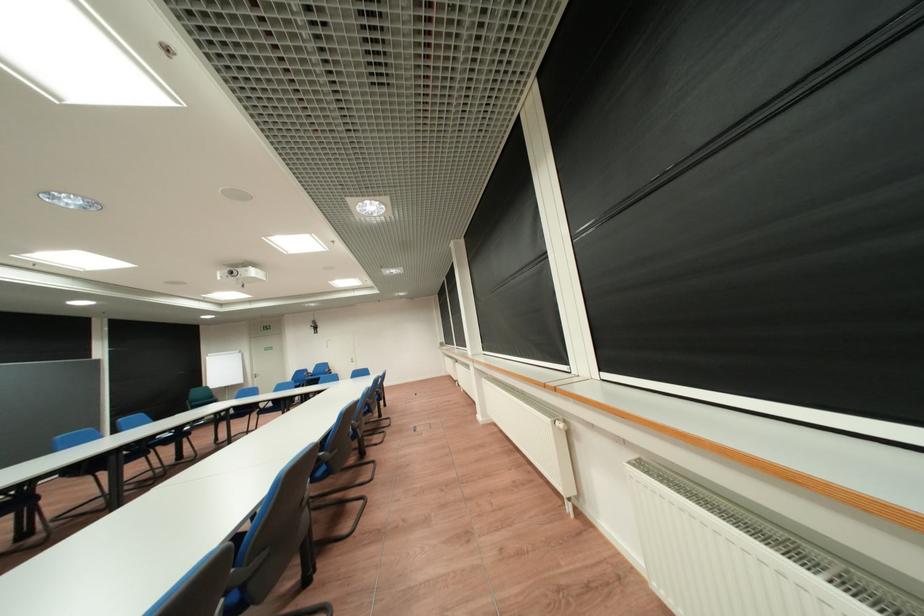
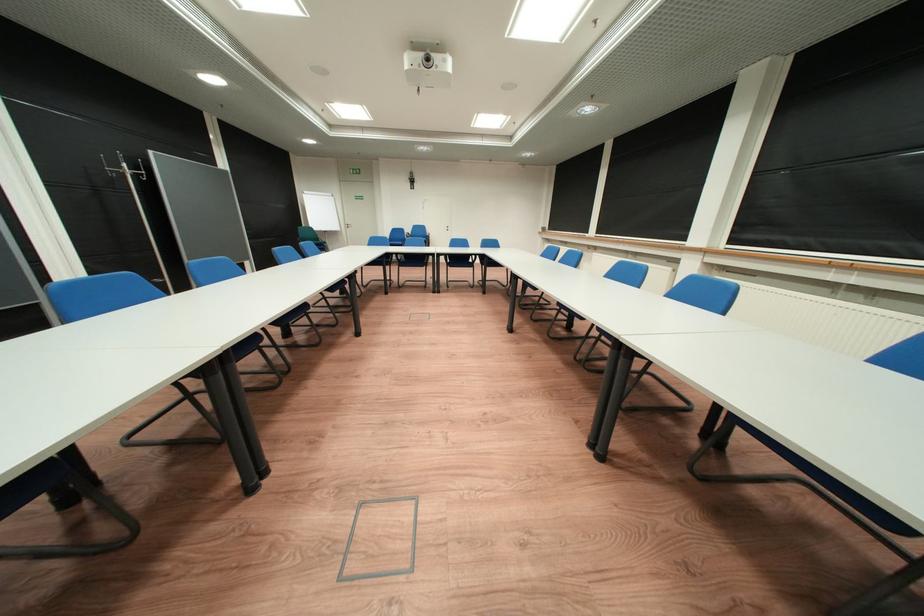
Question: In a continuous first-person perspective shot, in which direction is the camera moving?

Choices:
 (A) Left
 (B) Right
 (C) Forward
 (D) Backward

Answer: (A)